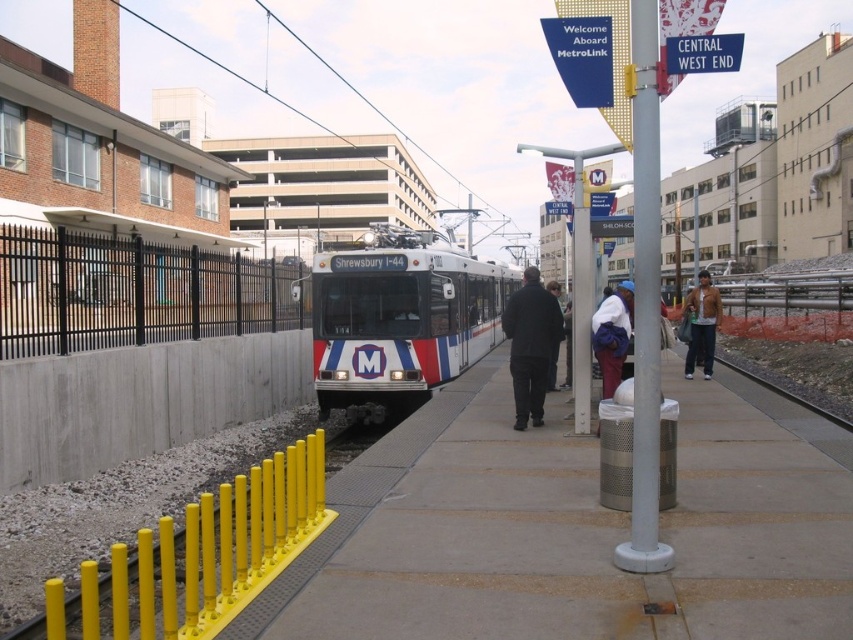
You are standing on the train platform and want to hang your leather jacket at right on the silver metallic pole at center. Is the pole within reach of the jacket?

The silver metallic pole at center is located below the leather jacket at right, so the pole is positioned lower than the jacket. Therefore, you can easily hang the jacket on the pole as it is within reach.

You are standing on the train platform and see the silver metallic pole at center and the leather jacket at right. Which object is closer to the edge of the platform?

The silver metallic pole at center is closer to the edge of the platform than the leather jacket at right because it is positioned to the left of the leather jacket at right, and the platform edge is on the left side of the pole.